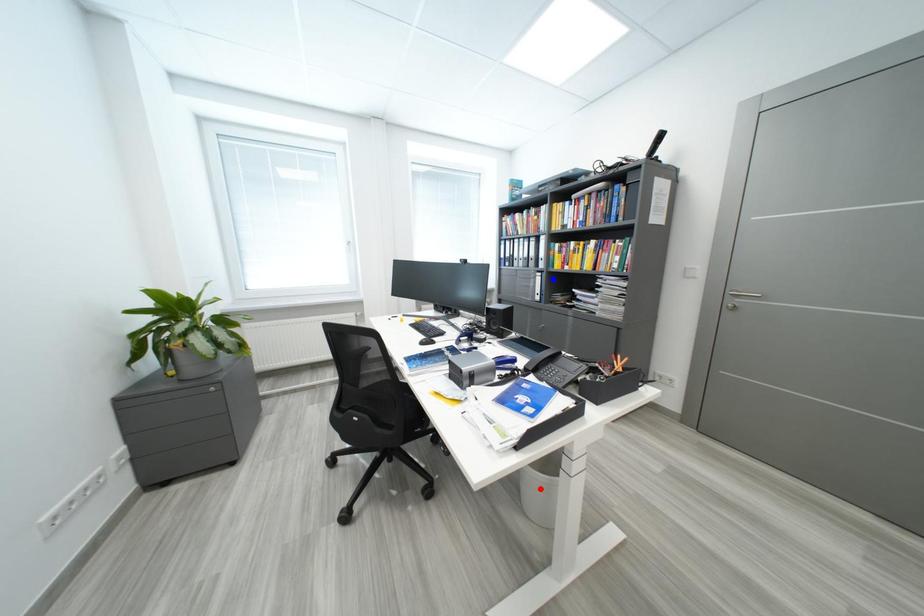
Question: Two points are marked on the image. Which point is closer to the camera?

Choices:
 (A) Blue point is closer.
 (B) Red point is closer.

Answer: (B)